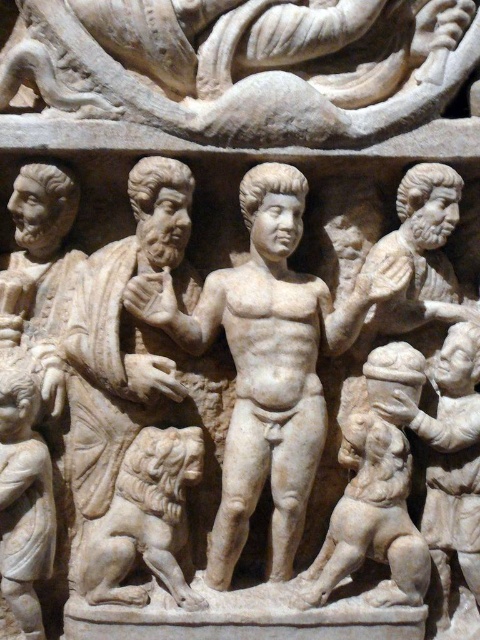
Is point (446, 58) farther from camera compared to point (108, 531)?

Yes, it is behind point (108, 531).

Is white marble snake at upper center above white marble lion at lower left?

Correct, white marble snake at upper center is located above white marble lion at lower left.

At what (x,y) coordinates should I click in order to perform the action: click on white marble snake at upper center. Please return your answer as a coordinate pair (x, y). This screenshot has width=480, height=640. Looking at the image, I should click on (243, 65).